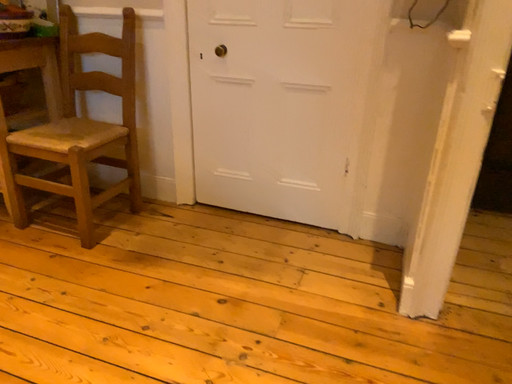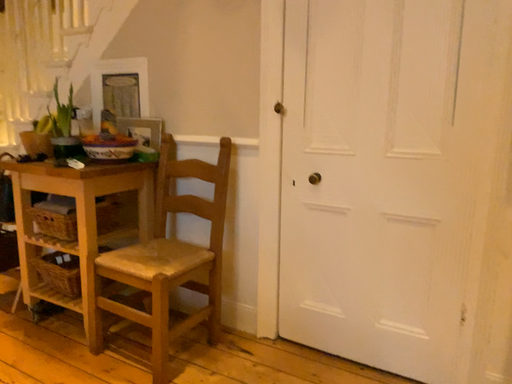
Question: Which way did the camera rotate in the video?

Choices:
 (A) rotated downward
 (B) rotated upward

Answer: (B)